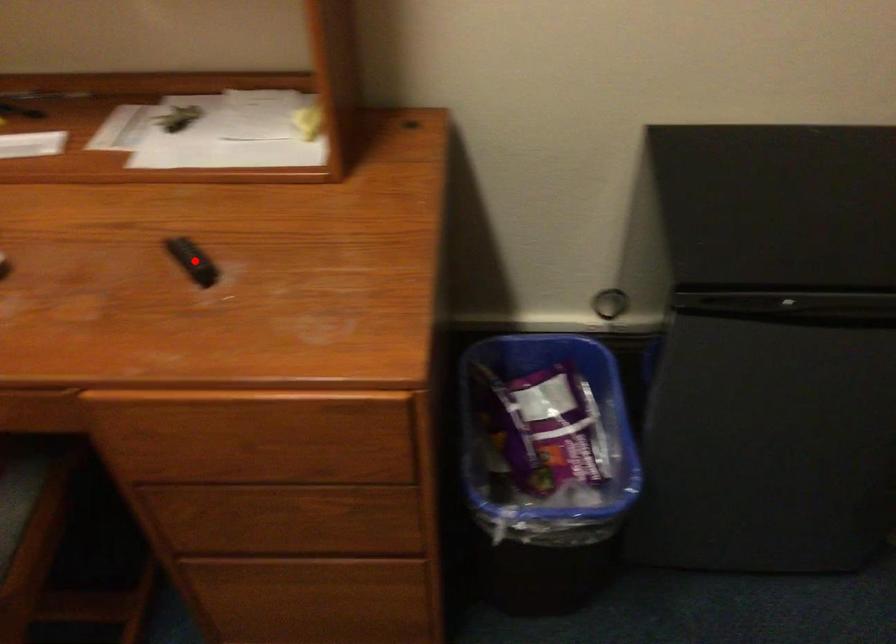
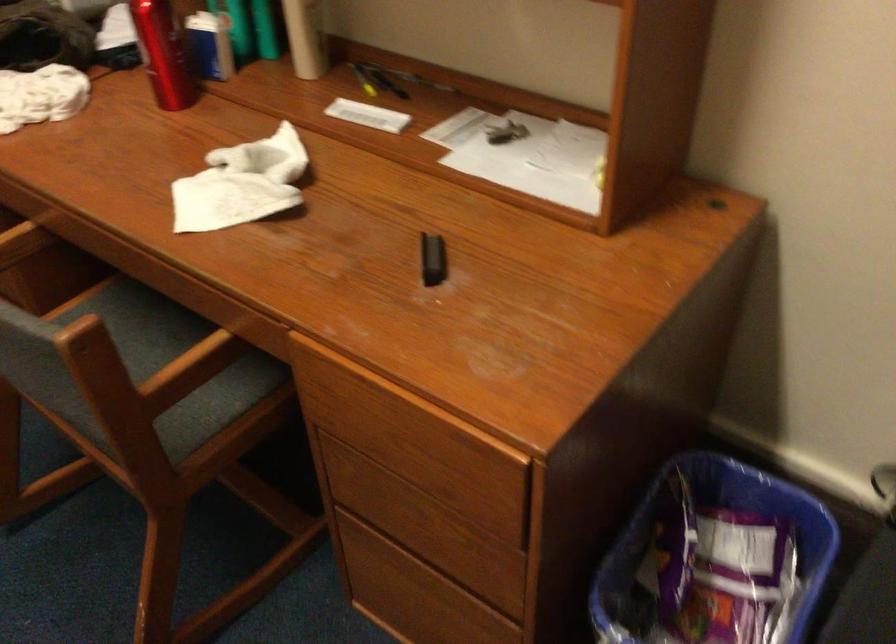
Find the pixel in the second image that matches the highlighted location in the first image.

(433, 259)